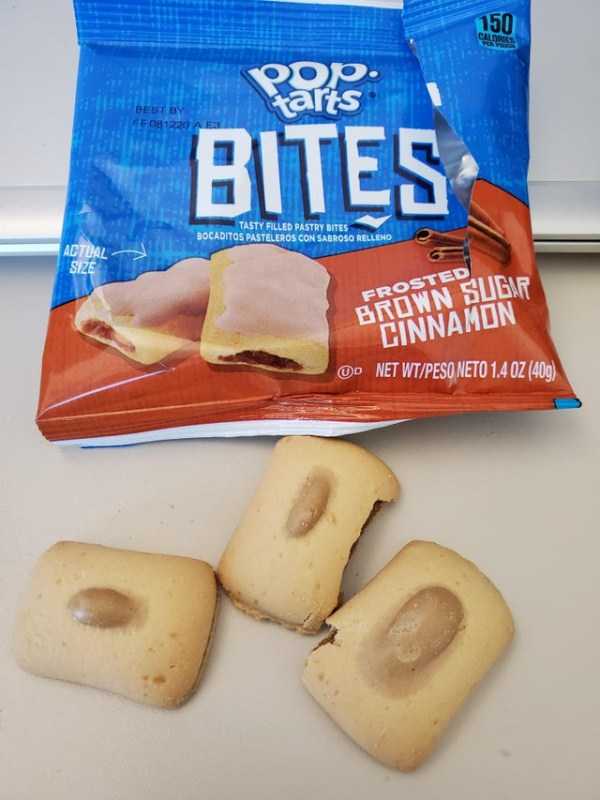
Find the location of a particular element. This screenshot has height=800, width=600. counter is located at coordinates (126, 494).